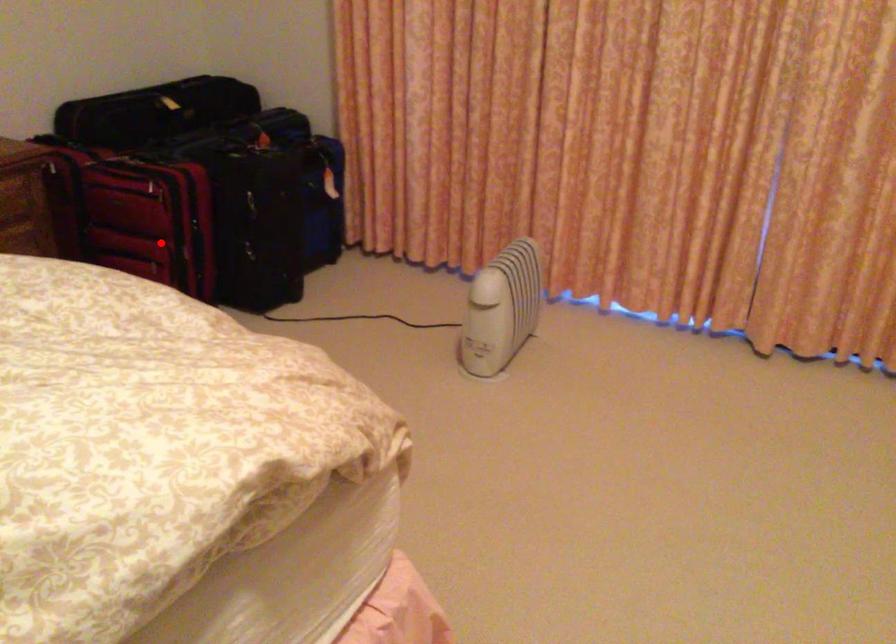
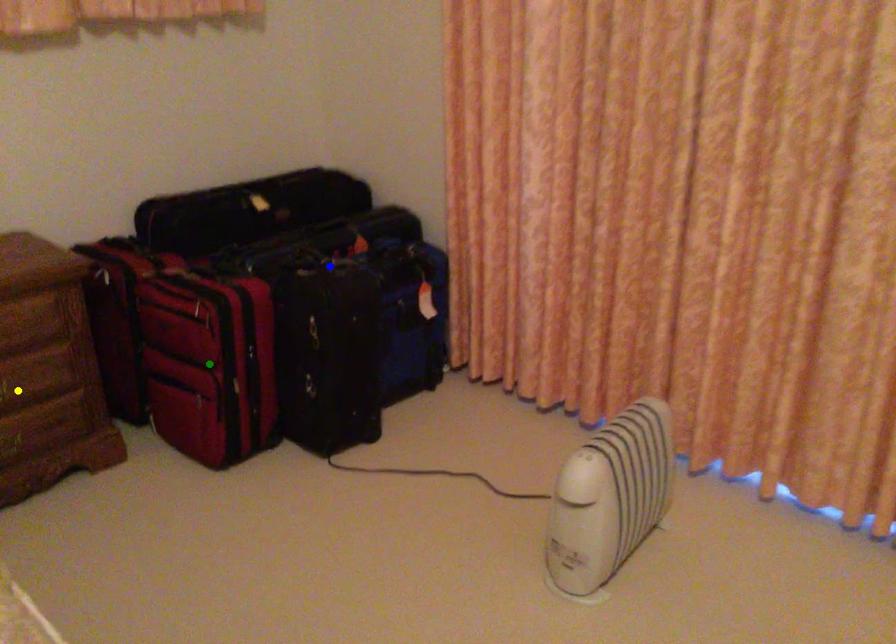
Question: I am providing you with two images of the same scene from different viewpoints. A red point is marked on the first image. You are given multiple points on the second image. Which mark in image 2 goes with the point in image 1?

Choices:
 (A) blue point
 (B) green point
 (C) yellow point

Answer: (B)